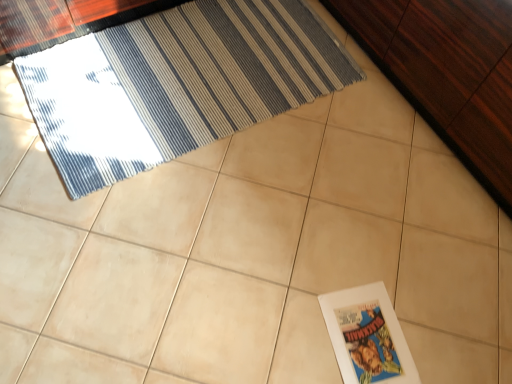
The width and height of the screenshot is (512, 384). Find the location of `free space behind white paper at lower right`. free space behind white paper at lower right is located at coordinates (373, 262).